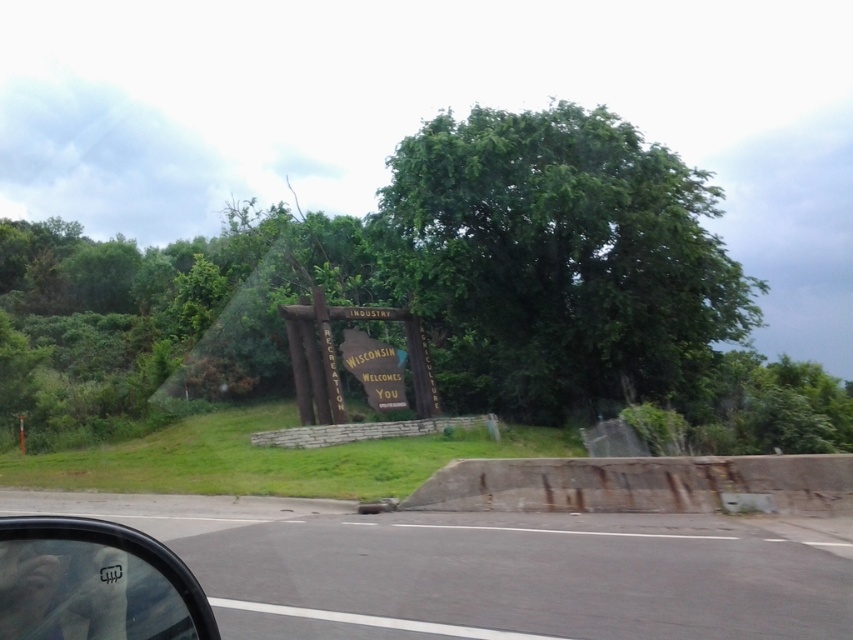
You are driving on a highway and see a green leafy tree at center and a gray asphalt highway at center. Which object takes up more space in the image?

The green leafy tree at center is bigger than the gray asphalt highway at center, so it takes up more space in the image.

You are a passenger in a car driving through Wisconsin. You notice the transparent plastic car window at lower left and the yellow paper sign at center. Which object is closer to the left side of your view?

The transparent plastic car window at lower left is positioned on the left side of the yellow paper sign at center, so it is closer to the left side of your view.